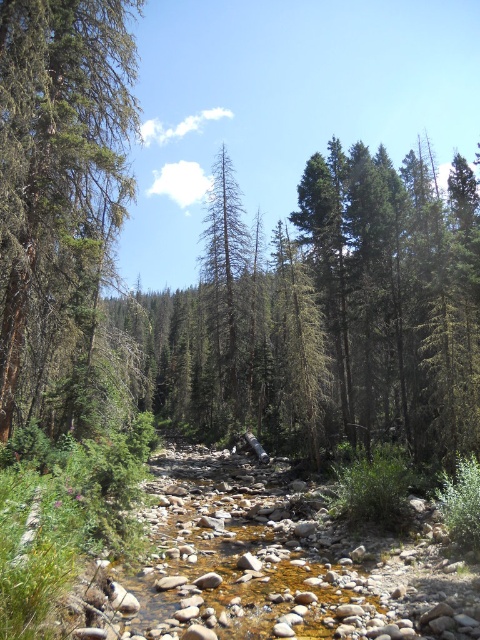
Which of these two, green matte tree at left or gray-brown bark tree at center, stands taller?

Standing taller between the two is gray-brown bark tree at center.

Which is behind, point (121, 164) or point (208, 396)?

The point (208, 396) is more distant.

This screenshot has height=640, width=480. I want to click on green matte tree at left, so click(59, 186).